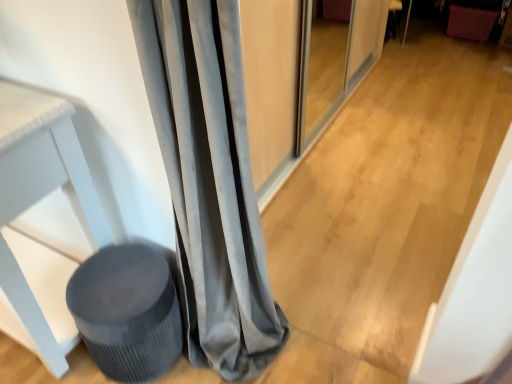
Question: Considering the positions of velvet burgundy swivel chair at upper right and matte gray screen door at center in the image, is velvet burgundy swivel chair at upper right wider or thinner than matte gray screen door at center?

Choices:
 (A) thin
 (B) wide

Answer: (B)

Question: Relative to matte gray screen door at center, is velvet burgundy swivel chair at upper right in front or behind?

Choices:
 (A) behind
 (B) front

Answer: (A)

Question: Which object is the farthest from the velvet gray curtain at left?

Choices:
 (A) matte gray screen door at center
 (B) matte gray stool at lower left
 (C) velvet burgundy swivel chair at upper right

Answer: (C)

Question: Which is farther from the velvet gray curtain at left?

Choices:
 (A) matte gray screen door at center
 (B) velvet burgundy swivel chair at upper right
 (C) matte gray stool at lower left

Answer: (B)